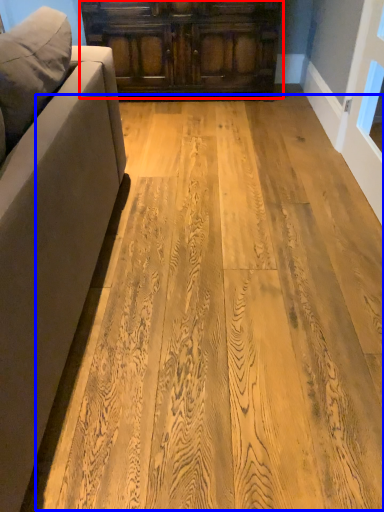
Question: Which object is further to the camera taking this photo, cabinetry (highlighted by a red box) or plywood (highlighted by a blue box)?

Choices:
 (A) cabinetry
 (B) plywood

Answer: (A)